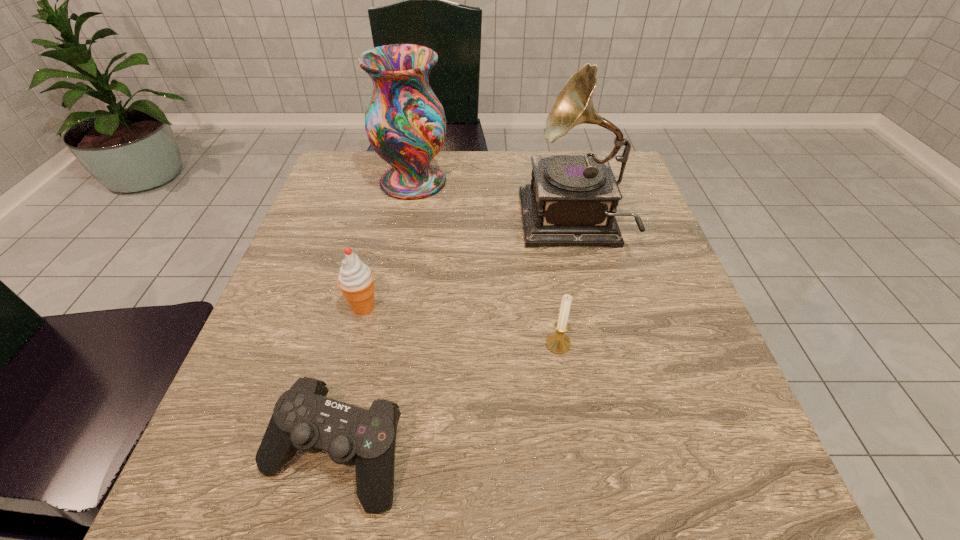
You are a GUI agent. You are given a task and a screenshot of the screen. Output one action in this format:
    pyautogui.click(x=<x>, y=<y>)
    Task: Click on the control that is at the left edge
    This screenshot has height=540, width=960.
    Given the screenshot: What is the action you would take?
    (x=304, y=419)

Locate an element on the screen. object that is at the right edge is located at coordinates (572, 200).

Where is `object situated at the far left corner`? object situated at the far left corner is located at coordinates (405, 122).

Identify the location of object at the near left corner. (304, 419).

Identify the location of object situated at the far right corner. This screenshot has height=540, width=960. (572, 200).

What are the coordinates of `vacant space at the far edge of the desktop` in the screenshot? It's located at (555, 151).

Locate an element on the screen. vacant region at the near edge of the desktop is located at coordinates (484, 463).

You are a GUI agent. You are given a task and a screenshot of the screen. Output one action in this format:
    pyautogui.click(x=<x>, y=<y>)
    Task: Click on the free region at the left edge
    The height and width of the screenshot is (540, 960).
    Given the screenshot: What is the action you would take?
    pyautogui.click(x=352, y=246)

This screenshot has width=960, height=540. What are the coordinates of `free space at the right edge` in the screenshot? It's located at (636, 266).

You are a GUI agent. You are given a task and a screenshot of the screen. Output one action in this format:
    pyautogui.click(x=<x>, y=<y>)
    Task: Click on the free region at the far left corner of the desktop
    The width and height of the screenshot is (960, 540).
    Given the screenshot: What is the action you would take?
    [342, 176]